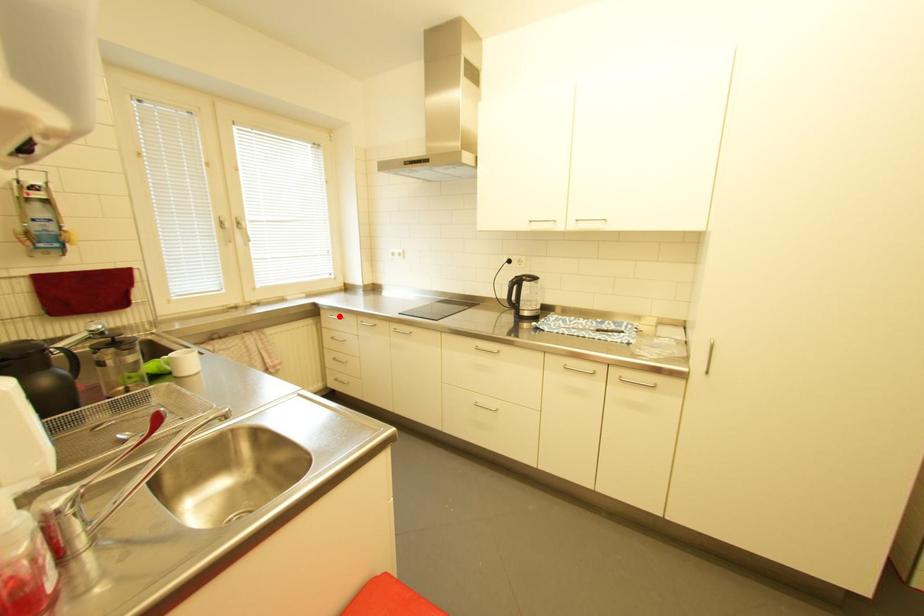
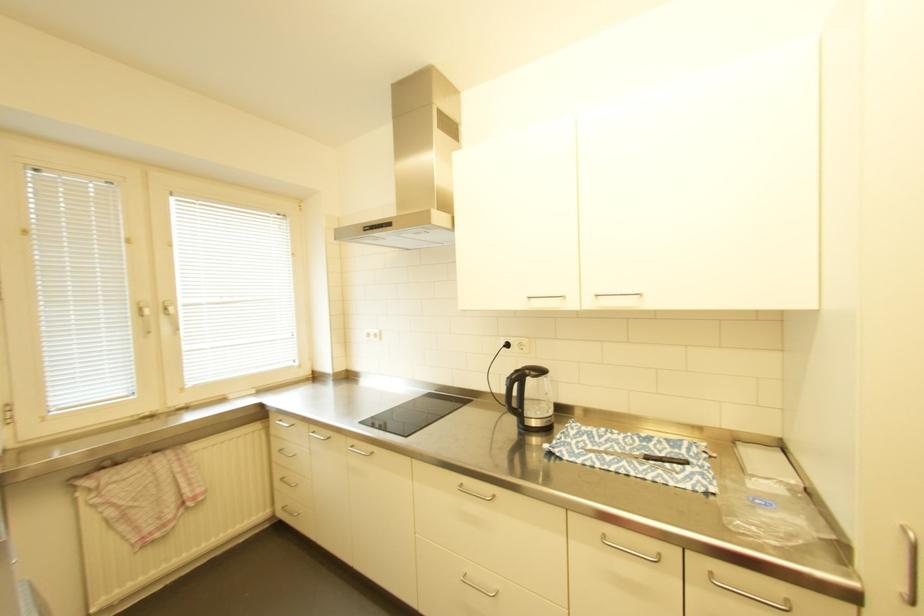
Question: A red point is marked in image1. In image2, is the corresponding 3D point closer to the camera or farther? Reply with the corresponding letter.

Choices:
 (A) The corresponding 3D point is closer.
 (B) The corresponding 3D point is farther.

Answer: (B)